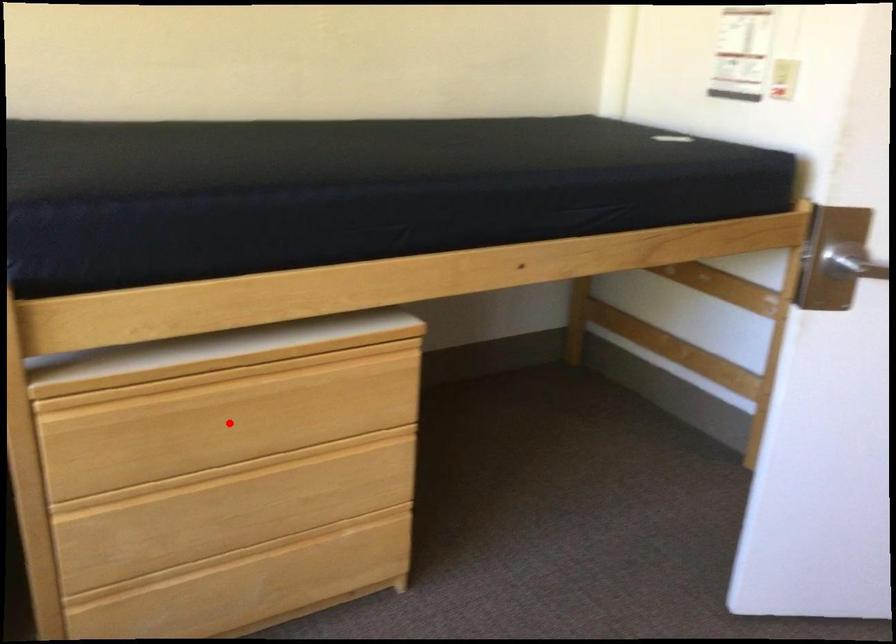
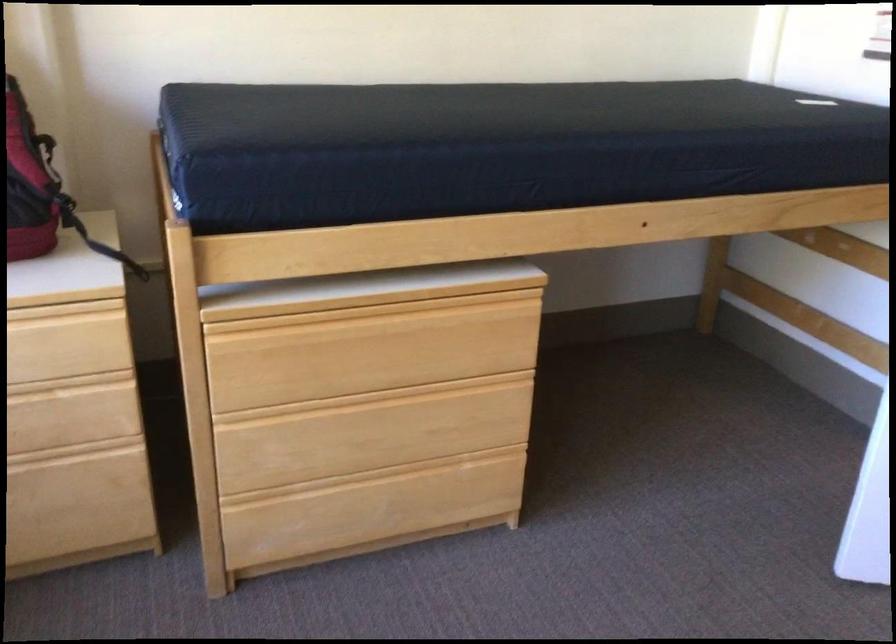
Question: I am providing you with two images of the same scene from different viewpoints. Image1 has a red point marked. In image2, the corresponding 3D location appears at what relative position? Reply with the corresponding letter.

Choices:
 (A) Closer
 (B) Farther

Answer: (B)